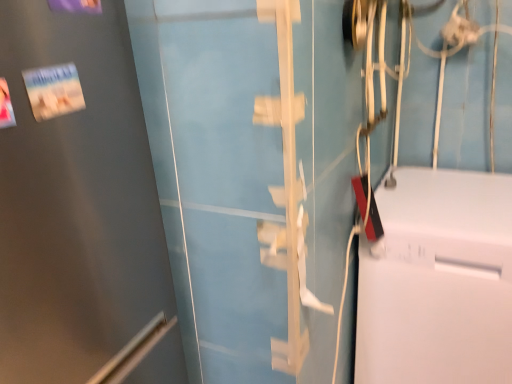
This screenshot has width=512, height=384. What do you see at coordinates (437, 281) in the screenshot?
I see `white glossy bathtub at right` at bounding box center [437, 281].

Find the location of a particular element. white glossy bathtub at right is located at coordinates pyautogui.click(x=437, y=281).

The image size is (512, 384). I want to click on white glossy bathtub at right, so click(437, 281).